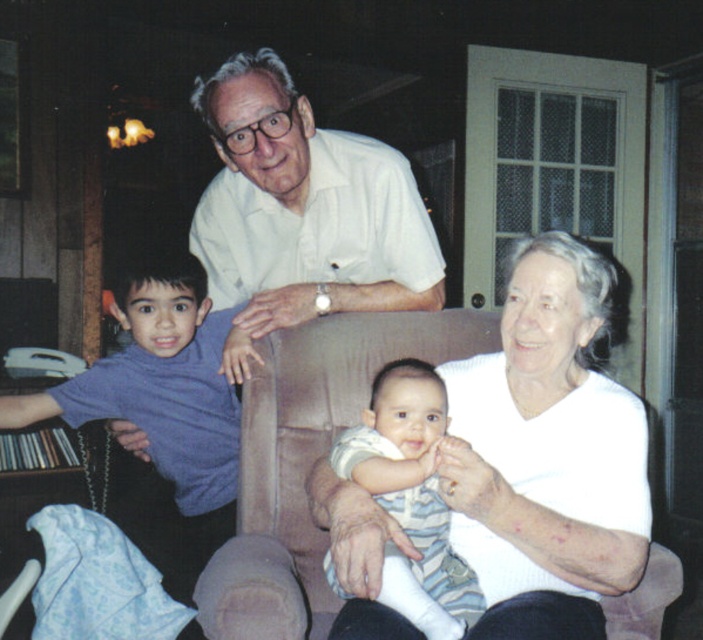
Question: Among these points, which one is farthest from the camera?

Choices:
 (A) (124, 317)
 (B) (560, 230)

Answer: (A)

Question: Which point is farther to the camera?

Choices:
 (A) (387, 308)
 (B) (543, 371)
 (C) (444, 506)
 (D) (212, 326)

Answer: (D)

Question: Can you confirm if white ribbed sweater at center is thinner than purple turtleneck shirt at left?

Choices:
 (A) yes
 (B) no

Answer: (B)

Question: Does purple turtleneck shirt at left have a greater width compared to striped cotton onesie at center?

Choices:
 (A) no
 (B) yes

Answer: (B)

Question: Is white smooth shirt at upper center above purple turtleneck shirt at left?

Choices:
 (A) no
 (B) yes

Answer: (B)

Question: Which object is positioned farthest from the purple turtleneck shirt at left?

Choices:
 (A) white ribbed sweater at center
 (B) white smooth shirt at upper center
 (C) striped cotton onesie at center

Answer: (A)